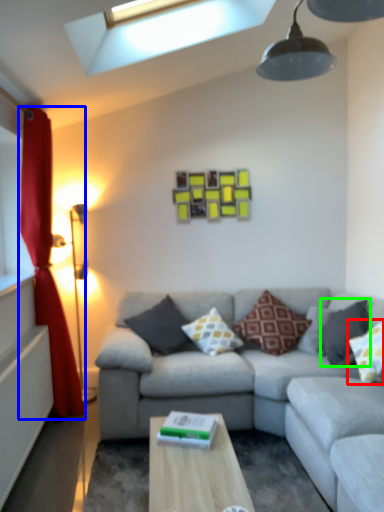
Question: Estimate the real-world distances between objects in this image. Which object is closer to pillow (highlighted by a red box), curtain (highlighted by a blue box) or pillow (highlighted by a green box)?

Choices:
 (A) curtain
 (B) pillow

Answer: (B)